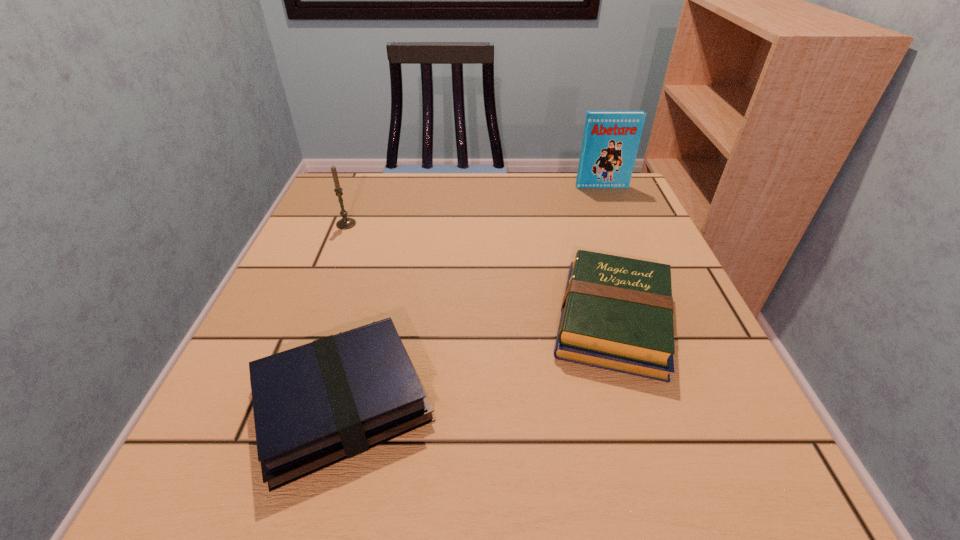
At what (x,y) coordinates should I click in order to perform the action: click on object that is the second closest to the tallest object. Please return your answer as a coordinate pair (x, y). This screenshot has width=960, height=540. Looking at the image, I should click on (345, 223).

Find the location of `book that stands as the second closest to the farthest book`. book that stands as the second closest to the farthest book is located at coordinates (317, 404).

The height and width of the screenshot is (540, 960). What are the coordinates of `book that stands as the closest to the leftmost book` in the screenshot? It's located at (617, 313).